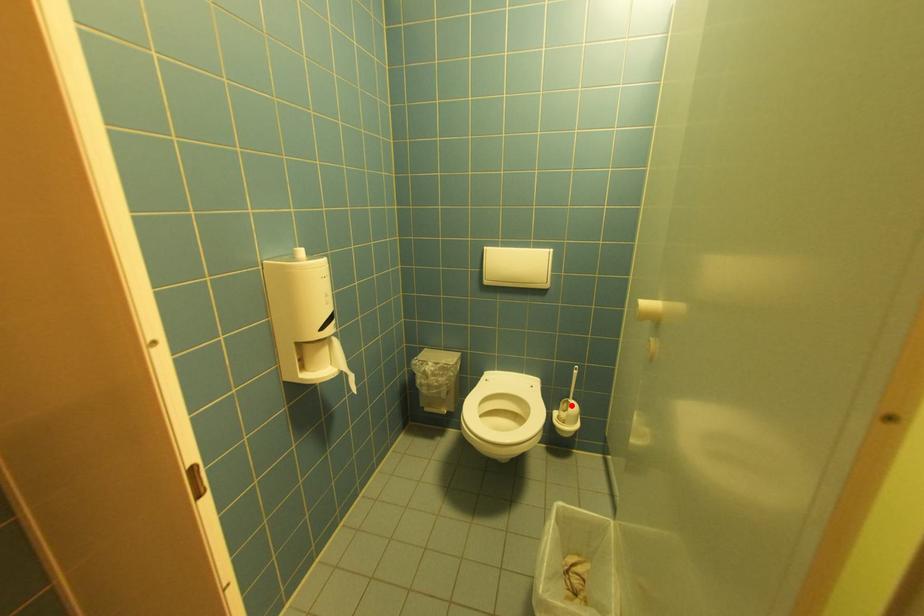
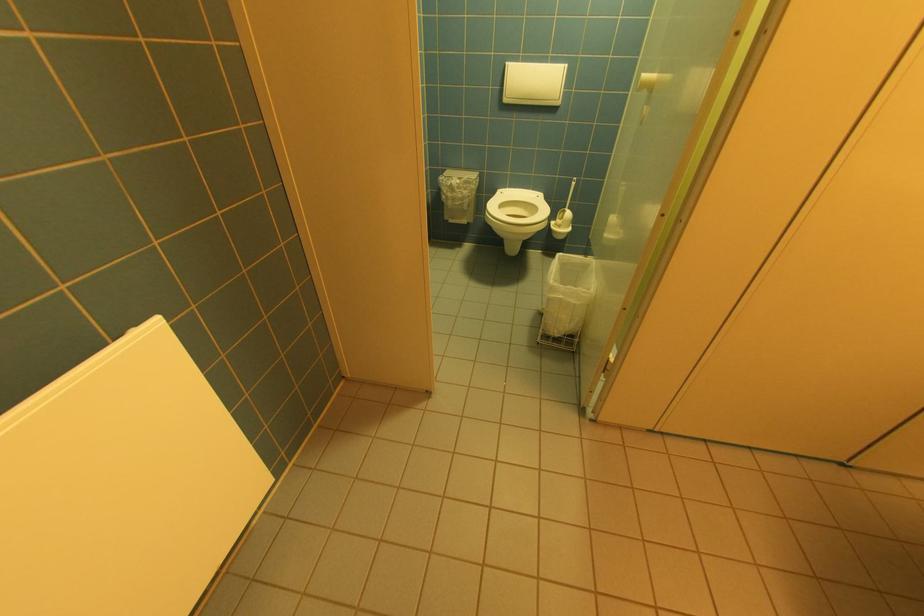
Question: I am providing you with two images of the same scene from different viewpoints. In image1, a red point is highlighted. Considering the same 3D point in image2, which of the following is correct?

Choices:
 (A) It is closer
 (B) It is farther

Answer: (A)